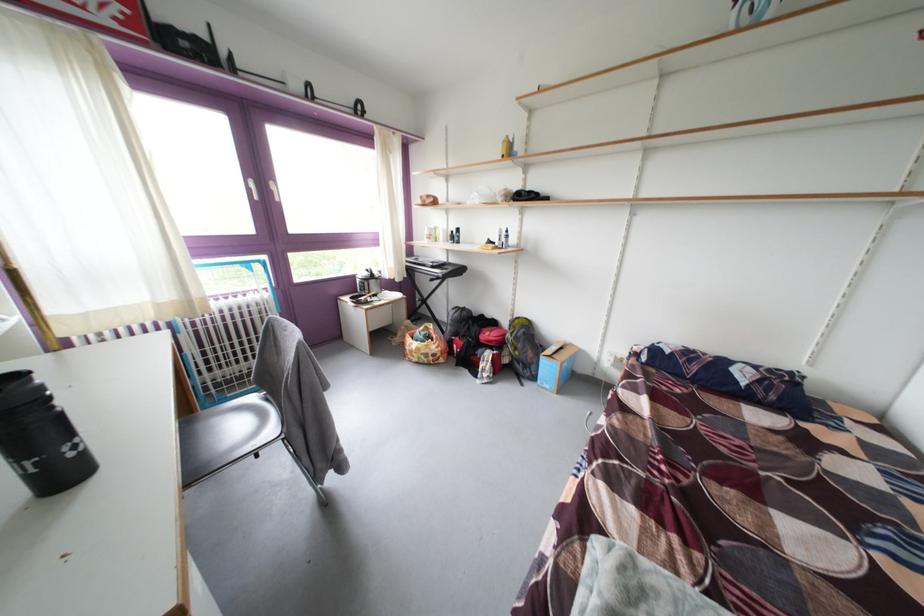
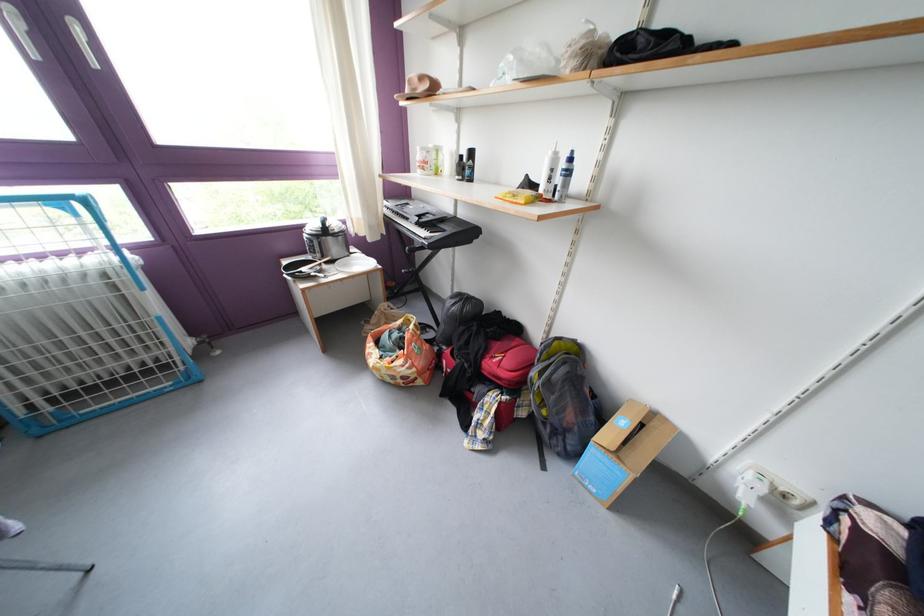
The point at (x=499, y=370) is marked in the first image. Where is the corresponding point in the second image?

(500, 426)